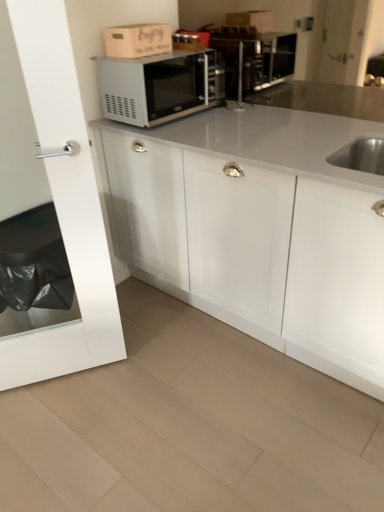
Locate an element on the screen. vacant region below transparent glass door at left (from a real-world perspective) is located at coordinates (67, 376).